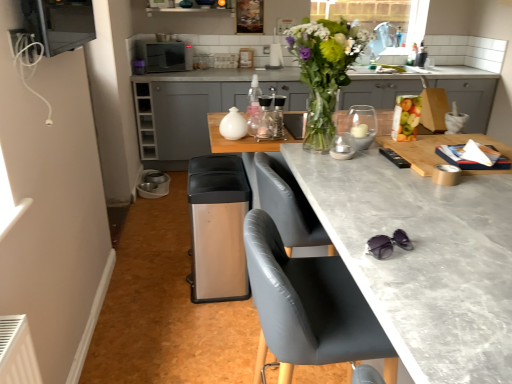
Question: Could you tell me if translucent glass candle holder at center, marked as the 2th appliance in a bottom-to-top arrangement, is facing stainless steel trash can at lower center, the third appliance in the right-to-left sequence?

Choices:
 (A) no
 (B) yes

Answer: (A)

Question: Considering the relative sizes of translucent glass candle holder at center, the 3th appliance from the top, and stainless steel trash can at lower center, the 4th appliance when ordered from top to bottom, in the image provided, is translucent glass candle holder at center, the 3th appliance from the top, taller than stainless steel trash can at lower center, the 4th appliance when ordered from top to bottom,?

Choices:
 (A) no
 (B) yes

Answer: (A)

Question: Does translucent glass candle holder at center, the first appliance in the right-to-left sequence, have a greater width compared to stainless steel trash can at lower center, the 4th appliance when ordered from top to bottom?

Choices:
 (A) yes
 (B) no

Answer: (B)

Question: Does translucent glass candle holder at center, which ranks as the 2th appliance in front-to-back order, have a lesser height compared to stainless steel trash can at lower center, which is counted as the fourth appliance, starting from the front?

Choices:
 (A) yes
 (B) no

Answer: (A)

Question: From a real-world perspective, is translucent glass candle holder at center, positioned as the 4th appliance in left-to-right order, on stainless steel trash can at lower center, which is the 2th appliance in left-to-right order?

Choices:
 (A) no
 (B) yes

Answer: (B)

Question: In terms of width, does matte gray countertop at center look wider or thinner when compared to stainless steel trash can at lower center, which is the 2th appliance in left-to-right order?

Choices:
 (A) thin
 (B) wide

Answer: (B)

Question: From the image's perspective, relative to stainless steel trash can at lower center, the third appliance in the right-to-left sequence, is matte gray countertop at center above or below?

Choices:
 (A) below
 (B) above

Answer: (A)

Question: Considering the positions of point (409, 205) and point (238, 165), is point (409, 205) closer or farther from the camera than point (238, 165)?

Choices:
 (A) farther
 (B) closer

Answer: (B)

Question: From a real-world perspective, is matte gray countertop at center physically located above or below stainless steel trash can at lower center, the first appliance when ordered from back to front?

Choices:
 (A) below
 (B) above

Answer: (B)

Question: Visually, is translucent glass candle holder at center, marked as the 2th appliance in a bottom-to-top arrangement, positioned to the left or to the right of metallic silver microwave at upper left, the fourth appliance from the bottom?

Choices:
 (A) left
 (B) right

Answer: (B)

Question: Is translucent glass candle holder at center, positioned as the 4th appliance in left-to-right order, inside or outside of metallic silver microwave at upper left, the first appliance positioned from the left?

Choices:
 (A) outside
 (B) inside

Answer: (A)

Question: Is translucent glass candle holder at center, marked as the 2th appliance in a bottom-to-top arrangement, taller or shorter than metallic silver microwave at upper left, placed as the fourth appliance when sorted from right to left?

Choices:
 (A) tall
 (B) short

Answer: (B)

Question: Looking at their shapes, would you say translucent glass candle holder at center, positioned as the 3th appliance in back-to-front order, is wider or thinner than metallic silver microwave at upper left, the 1th appliance positioned from the top?

Choices:
 (A) wide
 (B) thin

Answer: (B)

Question: Based on their positions, is white glossy jar at center, positioned as the third appliance in front-to-back order, located to the left or right of satin black microwave at upper center?

Choices:
 (A) left
 (B) right

Answer: (B)

Question: From a real-world perspective, is white glossy jar at center, positioned as the third appliance in front-to-back order, above or below satin black microwave at upper center?

Choices:
 (A) above
 (B) below

Answer: (B)